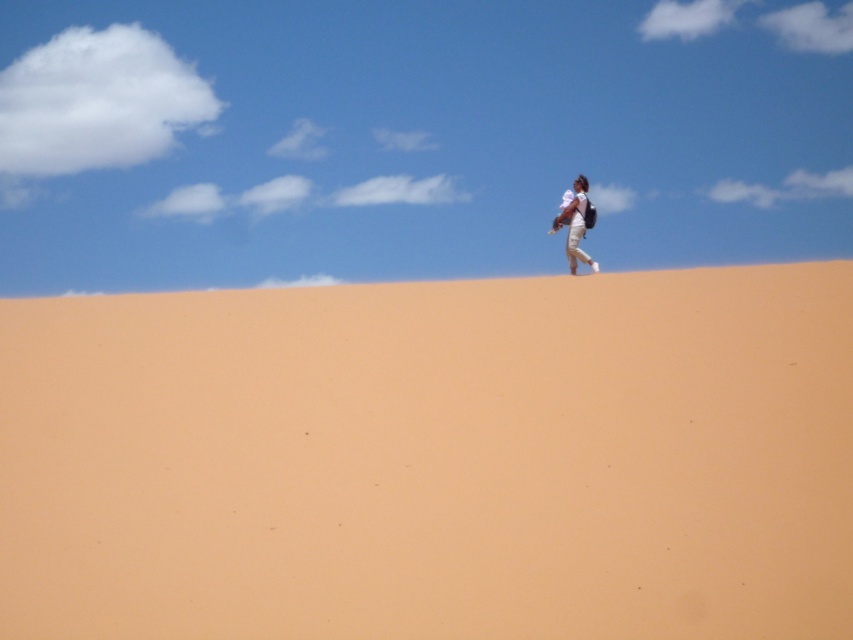
Question: Which object appears closest to the camera in this image?

Choices:
 (A) white cotton shirt at upper center
 (B) smooth tan sand at upper center

Answer: (B)

Question: Can you confirm if smooth tan sand at upper center is bigger than white cotton shirt at upper center?

Choices:
 (A) yes
 (B) no

Answer: (A)

Question: Which of the following is the farthest from the observer?

Choices:
 (A) smooth tan sand at upper center
 (B) white cotton shirt at upper center

Answer: (B)

Question: From the image, what is the correct spatial relationship of smooth tan sand at upper center in relation to white cotton shirt at upper center?

Choices:
 (A) left
 (B) right

Answer: (A)

Question: Is smooth tan sand at upper center below white cotton shirt at upper center?

Choices:
 (A) no
 (B) yes

Answer: (B)